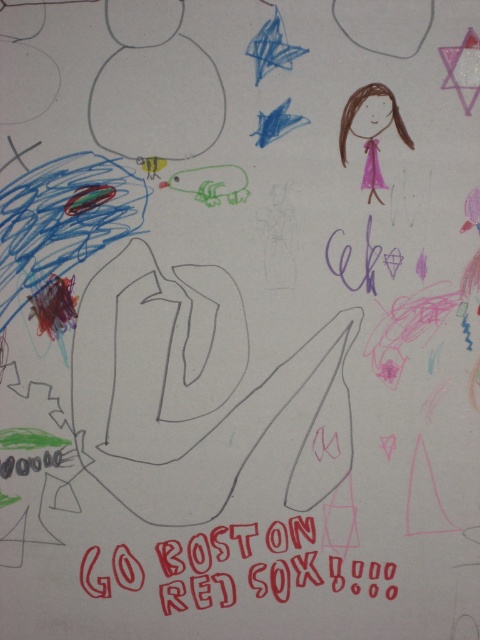
Question: Considering the relative positions of red paper text at center and pink paper doll at upper right in the image provided, where is red paper text at center located with respect to pink paper doll at upper right?

Choices:
 (A) above
 (B) below

Answer: (B)

Question: Which point appears farthest from the camera in this image?

Choices:
 (A) (300, 538)
 (B) (356, 90)

Answer: (A)

Question: Is red paper text at center in front of pink paper doll at upper right?

Choices:
 (A) yes
 (B) no

Answer: (B)

Question: In this image, where is red paper text at center located relative to pink paper doll at upper right?

Choices:
 (A) below
 (B) above

Answer: (A)